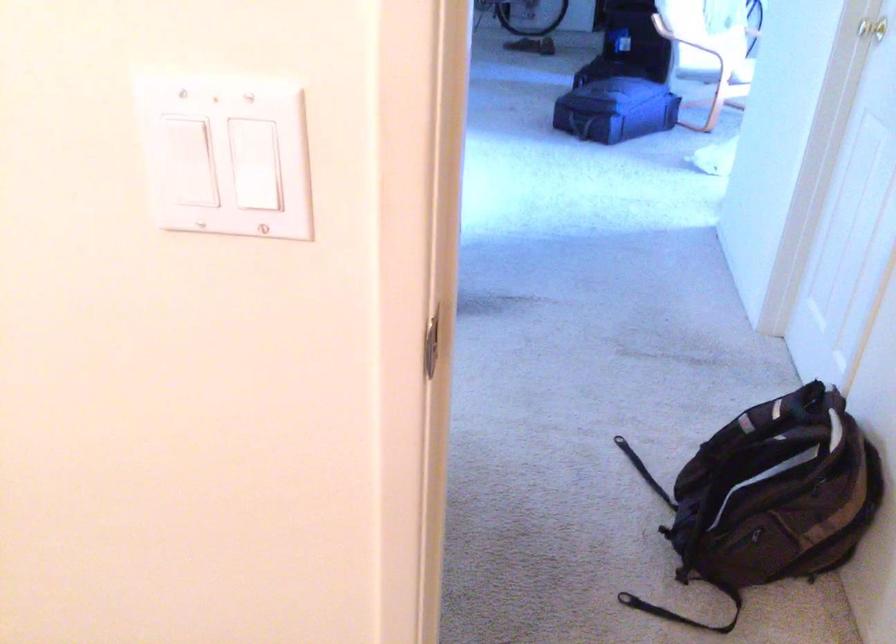
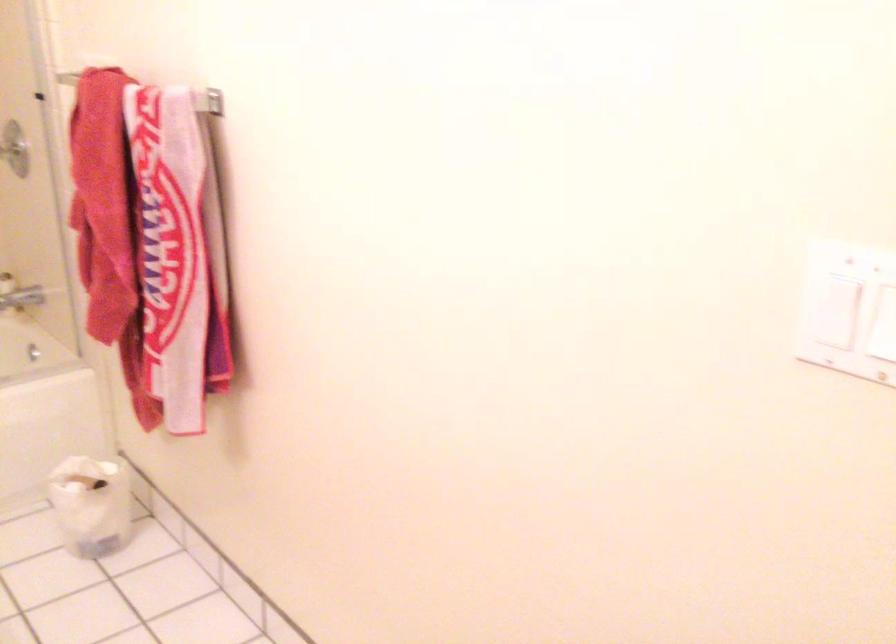
Find the pixel in the second image that matches the point at 187,172 in the first image.

(831, 295)